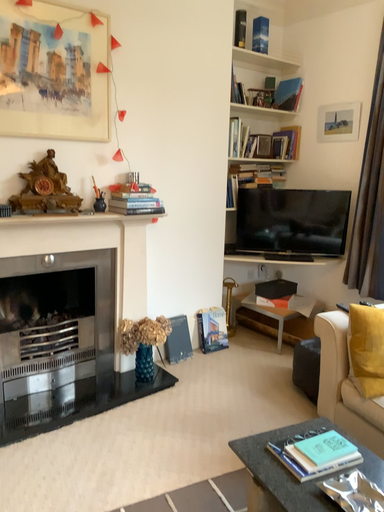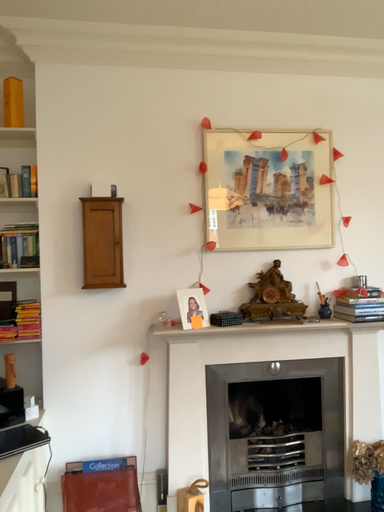
Question: Which way did the camera rotate in the video?

Choices:
 (A) rotated right
 (B) rotated left

Answer: (B)